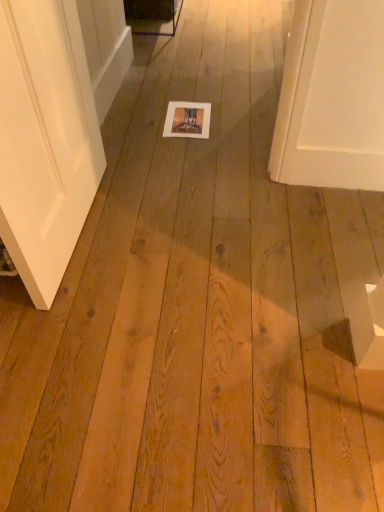
Find the location of `white glossy screen door at upper left`. white glossy screen door at upper left is located at coordinates (105, 48).

This screenshot has width=384, height=512. Describe the element at coordinates (105, 48) in the screenshot. I see `white glossy screen door at upper left` at that location.

This screenshot has height=512, width=384. What do you see at coordinates (187, 120) in the screenshot?
I see `matte cardboard postcard at center` at bounding box center [187, 120].

The height and width of the screenshot is (512, 384). Find the location of `matte cardboard postcard at center`. matte cardboard postcard at center is located at coordinates (187, 120).

Locate an element on the screen. white glossy screen door at upper left is located at coordinates (105, 48).

Considering the relative positions of matte cardboard postcard at center and white glossy screen door at upper left in the image provided, is matte cardboard postcard at center to the left or to the right of white glossy screen door at upper left?

Based on their positions, matte cardboard postcard at center is located to the right of white glossy screen door at upper left.

Which is in front, matte cardboard postcard at center or white glossy screen door at upper left?

white glossy screen door at upper left.

Considering the points (201, 138) and (102, 40), which point is in front, point (201, 138) or point (102, 40)?

Point (201, 138)

From the image's perspective, relative to white glossy screen door at upper left, is matte cardboard postcard at center above or below?

From the image's perspective, matte cardboard postcard at center appears below white glossy screen door at upper left.

From a real-world perspective, which object rests below the other?

From a 3D spatial view, matte cardboard postcard at center is below.

Can you confirm if matte cardboard postcard at center is thinner than white glossy screen door at upper left?

No.

Considering the sizes of objects matte cardboard postcard at center and white glossy screen door at upper left in the image provided, who is taller, matte cardboard postcard at center or white glossy screen door at upper left?

white glossy screen door at upper left is taller.

Does matte cardboard postcard at center have a larger size compared to white glossy screen door at upper left?

Incorrect, matte cardboard postcard at center is not larger than white glossy screen door at upper left.

Can we say matte cardboard postcard at center lies outside white glossy screen door at upper left?

matte cardboard postcard at center lies outside white glossy screen door at upper left's area.

Are matte cardboard postcard at center and white glossy screen door at upper left located far from each other?

No, matte cardboard postcard at center is not far away from white glossy screen door at upper left.

Is matte cardboard postcard at center facing towards white glossy screen door at upper left?

No, matte cardboard postcard at center is not aimed at white glossy screen door at upper left.

Based on the photo, can you tell me how much matte cardboard postcard at center and white glossy screen door at upper left differ in facing direction?

matte cardboard postcard at center and white glossy screen door at upper left are facing 91.3 degrees away from each other.

Image resolution: width=384 pixels, height=512 pixels. Identify the location of postcard lying behind the white glossy screen door at upper left. click(x=187, y=120).

Considering the relative positions of white glossy screen door at upper left and matte cardboard postcard at center in the image provided, is white glossy screen door at upper left to the left of matte cardboard postcard at center from the viewer's perspective?

Yes, white glossy screen door at upper left is to the left of matte cardboard postcard at center.

Considering the positions of objects white glossy screen door at upper left and matte cardboard postcard at center in the image provided, who is behind, white glossy screen door at upper left or matte cardboard postcard at center?

matte cardboard postcard at center is more distant.

Does point (100, 85) lie behind point (198, 117)?

That is False.

From the image's perspective, is white glossy screen door at upper left positioned above or below matte cardboard postcard at center?

Clearly, from the image's perspective, white glossy screen door at upper left is above matte cardboard postcard at center.

Consider the image. From a real-world perspective, is white glossy screen door at upper left over matte cardboard postcard at center?

Yes, from a real-world perspective, white glossy screen door at upper left is over matte cardboard postcard at center

Which object is wider, white glossy screen door at upper left or matte cardboard postcard at center?

matte cardboard postcard at center.

Is white glossy screen door at upper left taller or shorter than matte cardboard postcard at center?

In the image, white glossy screen door at upper left appears to be taller than matte cardboard postcard at center.

Can you confirm if white glossy screen door at upper left is smaller than matte cardboard postcard at center?

Actually, white glossy screen door at upper left might be larger than matte cardboard postcard at center.

Is white glossy screen door at upper left inside the boundaries of matte cardboard postcard at center, or outside?

white glossy screen door at upper left exists outside the volume of matte cardboard postcard at center.

Is white glossy screen door at upper left far away from matte cardboard postcard at center?

Actually, white glossy screen door at upper left and matte cardboard postcard at center are a little close together.

Is white glossy screen door at upper left aimed at matte cardboard postcard at center?

Yes, white glossy screen door at upper left is oriented towards matte cardboard postcard at center.

What's the angular difference between white glossy screen door at upper left and matte cardboard postcard at center's facing directions?

The facing directions of white glossy screen door at upper left and matte cardboard postcard at center are 91.3 degrees apart.

This screenshot has width=384, height=512. In order to click on screen door located in front of the matte cardboard postcard at center in this screenshot , I will do `click(105, 48)`.

Identify the location of screen door located above the matte cardboard postcard at center (from the image's perspective). Image resolution: width=384 pixels, height=512 pixels. (105, 48).

At what (x,y) coordinates should I click in order to perform the action: click on postcard lying behind the white glossy screen door at upper left. Please return your answer as a coordinate pair (x, y). The height and width of the screenshot is (512, 384). Looking at the image, I should click on (187, 120).